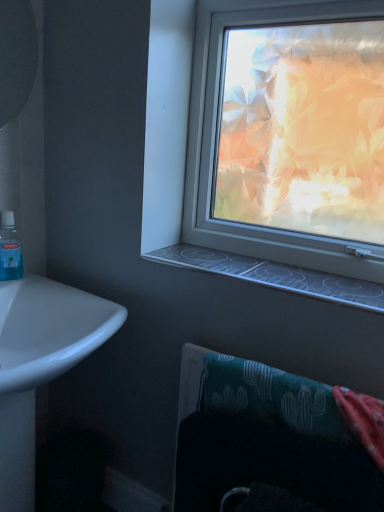
The image size is (384, 512). What do you see at coordinates (40, 365) in the screenshot?
I see `white glossy sink at lower left` at bounding box center [40, 365].

In order to click on blue translucent mouthwash at left in this screenshot , I will do `click(10, 249)`.

Where is `white glossy sink at lower left`? The width and height of the screenshot is (384, 512). white glossy sink at lower left is located at coordinates (40, 365).

Measure the distance between clear plastic window sill at center and teal fabric towel at lower right.

clear plastic window sill at center and teal fabric towel at lower right are 28.07 centimeters apart.

Does point (174, 249) come in front of point (379, 401)?

No, it is not.

Considering the sizes of objects clear plastic window sill at center and teal fabric towel at lower right in the image provided, who is smaller, clear plastic window sill at center or teal fabric towel at lower right?

clear plastic window sill at center is smaller.

Can you tell me how much clear plastic window sill at center and teal fabric towel at lower right differ in facing direction?

There is a 1.88-degree angle between the facing directions of clear plastic window sill at center and teal fabric towel at lower right.

What are the coordinates of `mouthwash on the left of the clear plastic window sill at center` in the screenshot? It's located at (10, 249).

Measure the distance between blue translucent mouthwash at left and clear plastic window sill at center.

blue translucent mouthwash at left and clear plastic window sill at center are 27.88 inches apart.

Is blue translucent mouthwash at left oriented towards clear plastic window sill at center?

No, blue translucent mouthwash at left is not turned towards clear plastic window sill at center.

Is blue translucent mouthwash at left positioned far away from clear plastic window sill at center?

No, blue translucent mouthwash at left is not far away from clear plastic window sill at center.

From the image's perspective, which is above, clear plastic window sill at center or white glossy sink at lower left?

From the image's view, clear plastic window sill at center is above.

This screenshot has width=384, height=512. I want to click on sink beneath the clear plastic window sill at center (from a real-world perspective), so click(40, 365).

Is clear plastic window sill at center bigger or smaller than white glossy sink at lower left?

Clearly, clear plastic window sill at center is smaller in size than white glossy sink at lower left.

Is point (181, 256) farther from camera compared to point (34, 276)?

No, it is not.

Can you confirm if teal fabric towel at lower right is smaller than clear plastic window sill at center?

Incorrect, teal fabric towel at lower right is not smaller in size than clear plastic window sill at center.

Is clear plastic window sill at center at the back of teal fabric towel at lower right?

No, teal fabric towel at lower right's orientation is not away from clear plastic window sill at center.

Considering the positions of points (282, 381) and (202, 249), is point (282, 381) farther from camera compared to point (202, 249)?

No, it is in front of (202, 249).

From the picture: Is teal fabric towel at lower right positioned in front of white glossy sink at lower left?

No, teal fabric towel at lower right is further to the viewer.

Can you confirm if teal fabric towel at lower right is wider than white glossy sink at lower left?

In fact, teal fabric towel at lower right might be narrower than white glossy sink at lower left.

Does point (349, 439) come in front of point (92, 308)?

That is True.

From a real-world perspective, is blue translucent mouthwash at left on teal fabric towel at lower right?

Correct, in the physical world, blue translucent mouthwash at left is higher than teal fabric towel at lower right.

Which is closer, (9, 220) or (356, 416)?

The point (356, 416) is more forward.

Which is correct: blue translucent mouthwash at left is inside teal fabric towel at lower right, or outside of it?

blue translucent mouthwash at left is spatially situated outside teal fabric towel at lower right.

In the scene shown: In terms of height, does blue translucent mouthwash at left look taller or shorter compared to teal fabric towel at lower right?

Clearly, blue translucent mouthwash at left is shorter compared to teal fabric towel at lower right.

Between blue translucent mouthwash at left and white glossy sink at lower left, which one is positioned behind?

blue translucent mouthwash at left.

Is blue translucent mouthwash at left beside white glossy sink at lower left?

No, blue translucent mouthwash at left is not beside white glossy sink at lower left.

Could you tell me if blue translucent mouthwash at left is turned towards white glossy sink at lower left?

No, blue translucent mouthwash at left is not oriented towards white glossy sink at lower left.

Is white glossy sink at lower left located within blue translucent mouthwash at left?

No, white glossy sink at lower left is located outside of blue translucent mouthwash at left.

You are a GUI agent. You are given a task and a screenshot of the screen. Output one action in this format:
    pyautogui.click(x=<x>, y=<y>)
    Task: Click on the window sill on the left of teal fabric towel at lower right
    
    Given the screenshot: What is the action you would take?
    pyautogui.click(x=274, y=275)

Where is `mouthwash above the clear plastic window sill at center (from the image's perspective)`? Image resolution: width=384 pixels, height=512 pixels. mouthwash above the clear plastic window sill at center (from the image's perspective) is located at coordinates (10, 249).

Based on their spatial positions, is white glossy sink at lower left or clear plastic window sill at center further from blue translucent mouthwash at left?

The object further to blue translucent mouthwash at left is clear plastic window sill at center.

Considering their positions, is teal fabric towel at lower right positioned closer to blue translucent mouthwash at left than clear plastic window sill at center?

clear plastic window sill at center lies closer to blue translucent mouthwash at left than the other object.

Considering their positions, is blue translucent mouthwash at left positioned closer to white glossy sink at lower left than clear plastic window sill at center?

The object closer to white glossy sink at lower left is blue translucent mouthwash at left.

Estimate the real-world distances between objects in this image. Which object is further from teal fabric towel at lower right, blue translucent mouthwash at left or clear plastic window sill at center?

The object further to teal fabric towel at lower right is blue translucent mouthwash at left.

Estimate the real-world distances between objects in this image. Which object is closer to clear plastic window sill at center, blue translucent mouthwash at left or white glossy sink at lower left?

white glossy sink at lower left.

Considering their positions, is teal fabric towel at lower right positioned further to clear plastic window sill at center than blue translucent mouthwash at left?

Among the two, blue translucent mouthwash at left is located further to clear plastic window sill at center.

Based on their spatial positions, is blue translucent mouthwash at left or white glossy sink at lower left closer to teal fabric towel at lower right?

white glossy sink at lower left is closer to teal fabric towel at lower right.

Looking at the image, which one is located closer to white glossy sink at lower left, blue translucent mouthwash at left or teal fabric towel at lower right?

blue translucent mouthwash at left is closer to white glossy sink at lower left.

Locate an element on the screen. Image resolution: width=384 pixels, height=512 pixels. sink between blue translucent mouthwash at left and clear plastic window sill at center in the horizontal direction is located at coordinates (40, 365).

I want to click on window sill between blue translucent mouthwash at left and teal fabric towel at lower right, so click(274, 275).

You are a GUI agent. You are given a task and a screenshot of the screen. Output one action in this format:
    pyautogui.click(x=<x>, y=<y>)
    Task: Click on the window sill located between white glossy sink at lower left and teal fabric towel at lower right in the left-right direction
    
    Given the screenshot: What is the action you would take?
    pyautogui.click(x=274, y=275)

You are a GUI agent. You are given a task and a screenshot of the screen. Output one action in this format:
    pyautogui.click(x=<x>, y=<y>)
    Task: Click on the sink between blue translucent mouthwash at left and teal fabric towel at lower right from left to right
    The width and height of the screenshot is (384, 512).
    Given the screenshot: What is the action you would take?
    pyautogui.click(x=40, y=365)